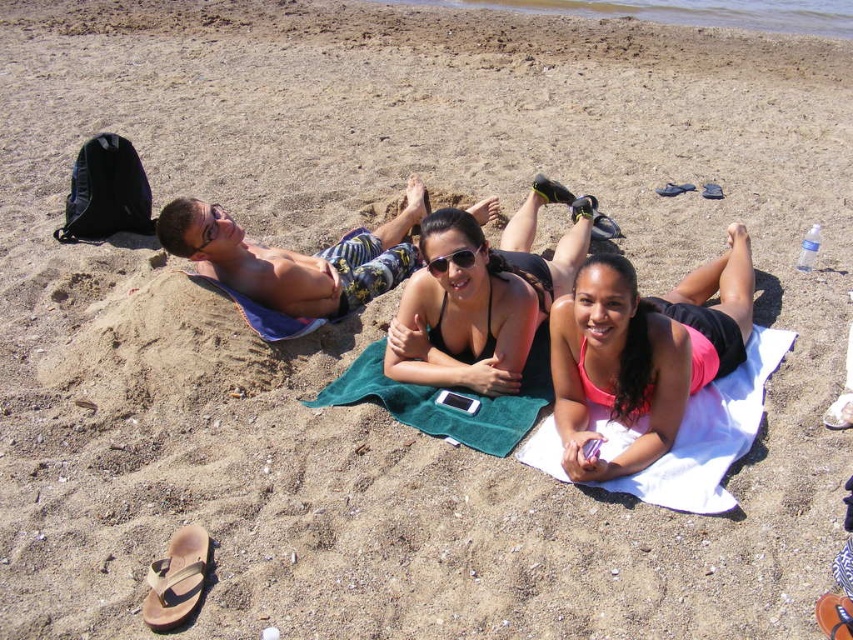
Can you confirm if pink matte tank top at center is positioned above black matte bikini top at center?

Actually, pink matte tank top at center is below black matte bikini top at center.

Between pink matte tank top at center and black matte bikini top at center, which one has less height?

With less height is black matte bikini top at center.

Identify the location of pink matte tank top at center. The image size is (853, 640). (643, 349).

Is point (506, 452) farther from viewer compared to point (161, 576)?

Yes.

Between green towel at center and brown leather sandal at lower left, which one is positioned higher?

green towel at center is above.

Who is more forward, (490, 413) or (189, 548)?

Point (189, 548)

Find the location of a particular element. The width and height of the screenshot is (853, 640). green towel at center is located at coordinates (448, 401).

Is white cotton towel at lower right below sunglasses at center?

Yes, white cotton towel at lower right is below sunglasses at center.

Does white cotton towel at lower right appear on the right side of sunglasses at center?

Indeed, white cotton towel at lower right is positioned on the right side of sunglasses at center.

Does point (744, 364) lie behind point (432, 266)?

Yes, point (744, 364) is farther from viewer.

This screenshot has height=640, width=853. In order to click on white cotton towel at lower right in this screenshot , I will do `click(711, 435)`.